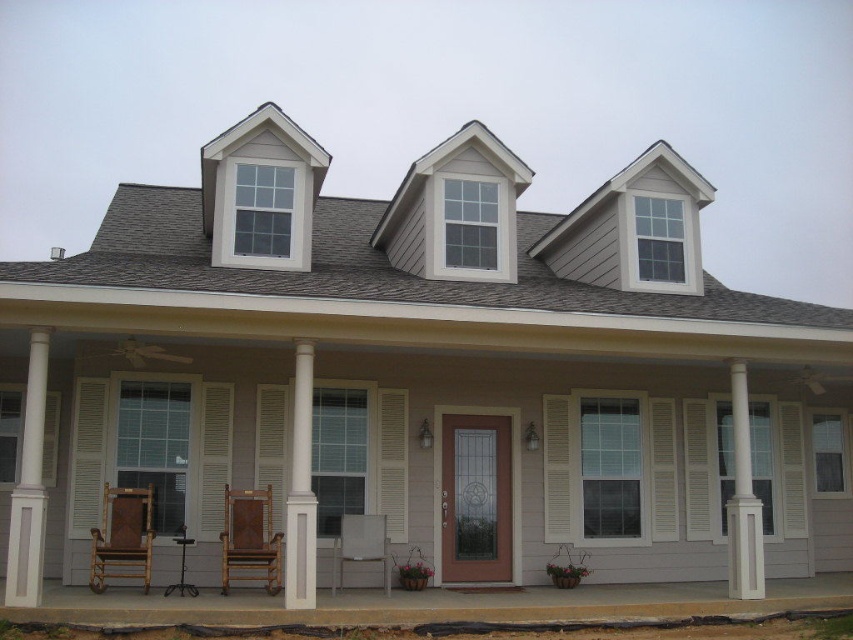
Is point (27, 538) positioned in front of point (737, 403)?

That is True.

Looking at this image, between white smooth column at left and white painted wood column at right, which one is positioned higher?

white smooth column at left is above.

Who is more distant from viewer, (28, 464) or (753, 541)?

The point (753, 541) is behind.

Locate an element on the screen. white smooth column at left is located at coordinates (x=28, y=486).

Can you confirm if white smooth column at left is wider than brown wooden rocking chair at center?

No, white smooth column at left is not wider than brown wooden rocking chair at center.

Who is more distant from viewer, (10,556) or (242,560)?

The point (242,560) is more distant.

You are a GUI agent. You are given a task and a screenshot of the screen. Output one action in this format:
    pyautogui.click(x=<x>, y=<y>)
    Task: Click on the white smooth column at left
    
    Given the screenshot: What is the action you would take?
    pyautogui.click(x=28, y=486)

Can you confirm if white painted wood column at right is wider than light brown wooden chair at center?

Incorrect, white painted wood column at right's width does not surpass light brown wooden chair at center's.

This screenshot has height=640, width=853. What are the coordinates of `white painted wood column at right` in the screenshot? It's located at (743, 499).

What are the coordinates of `white painted wood column at right` in the screenshot? It's located at (743, 499).